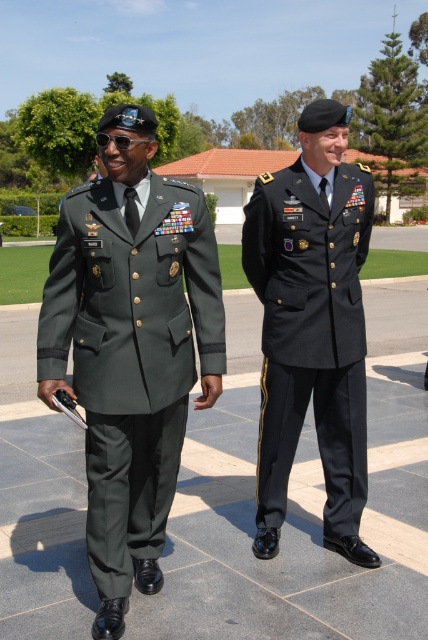
You are a tailor measuring uniforms for two military personnel. The green fabric uniform at left and the black matte uniform at center need alterations. Which uniform requires a wider alteration to fit a larger frame?

The green fabric uniform at left requires a wider alteration to fit a larger frame because its width surpasses that of the black matte uniform at center.

You are a photographer positioned at the center of the image. You want to take a photo that includes both the point at [133,509] and the point at [357,465]. Which point should you focus on first to ensure both are in the frame?

You should focus on point [133,509] first because it is closer to you than point [357,465], ensuring both points remain in the frame.

You are a photographer standing in front of the green fabric uniform at left. You want to take a photo of them from a distance that is exactly 9 feet away. Is your current position suitable?

The green fabric uniform at left and viewer are 8.98 feet apart from each other, so your current position is suitable because it is almost exactly 9 feet away.